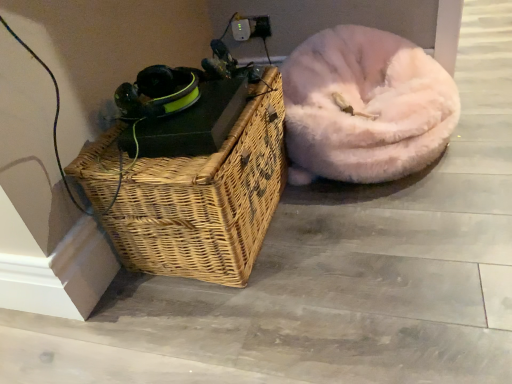
Locate an element on the screen. free spot to the right of woven wood picnic basket at lower left is located at coordinates (374, 236).